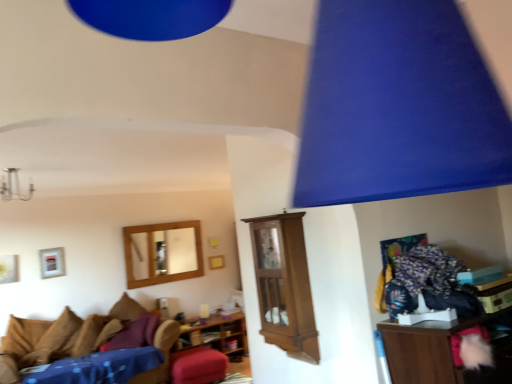
The image size is (512, 384). What do you see at coordinates (106, 332) in the screenshot?
I see `brown suede pillow at lower left, which is the first pillow from front to back` at bounding box center [106, 332].

You are a GUI agent. You are given a task and a screenshot of the screen. Output one action in this format:
    pyautogui.click(x=<x>, y=<y>)
    Task: Click on the wooden cabinet at center, the second shelf from the back
    The height and width of the screenshot is (384, 512).
    Given the screenshot: What is the action you would take?
    pyautogui.click(x=284, y=285)

At what (x,y) coordinates should I click in order to perform the action: click on wooden shelf at center, the 1th shelf positioned from the left. Please return your answer as a coordinate pair (x, y). The height and width of the screenshot is (384, 512). Looking at the image, I should click on (218, 335).

Find the location of a particular element. This screenshot has height=384, width=512. metallic chandelier at upper left is located at coordinates (14, 187).

The height and width of the screenshot is (384, 512). What do you see at coordinates (60, 336) in the screenshot?
I see `velvet purple sofa at lower left` at bounding box center [60, 336].

You are a GUI agent. You are given a task and a screenshot of the screen. Output one action in this format:
    pyautogui.click(x=<x>, y=<y>)
    Task: Click on the velvet purple sofa at lower left
    This screenshot has width=512, height=384.
    Given the screenshot: What is the action you would take?
    pyautogui.click(x=60, y=336)

Locate an element on the screen. This screenshot has width=512, height=384. silver metallic picture frame at upper left, which is counted as the 2th picture frame, starting from the back is located at coordinates (52, 262).

Could velvet red stool at center be considered to be inside velvet purple sofa at lower left?

No, velvet red stool at center is not a part of velvet purple sofa at lower left.

Is velvet purple sofa at lower left positioned far away from velvet red stool at center?

velvet purple sofa at lower left is positioned a significant distance from velvet red stool at center.

Does point (90, 321) come farther from viewer compared to point (199, 370)?

That is True.

Is metallic chandelier at upper left facing towards velvet purple sofa at lower left?

No, metallic chandelier at upper left is not oriented towards velvet purple sofa at lower left.

From a real-world perspective, is metallic chandelier at upper left physically above velvet purple sofa at lower left?

Yes.

Between point (10, 175) and point (41, 331), which one is positioned behind?

The point (41, 331) is more distant.

Who is bigger, metallic chandelier at upper left or velvet purple sofa at lower left?

velvet purple sofa at lower left is bigger.

Which is in front, point (186, 344) or point (14, 192)?

The point (14, 192) is closer to the camera.

Based on the photo, what's the angular difference between wooden shelf at center, the 1th shelf positioned from the left, and metallic chandelier at upper left's facing directions?

89.1 degrees.

Does wooden shelf at center, arranged as the 2th shelf when viewed from the right, come behind metallic chandelier at upper left?

Yes, it is behind metallic chandelier at upper left.

How distant is wooden shelf at center, which appears as the first shelf when ordered from the bottom, from metallic chandelier at upper left?

A distance of 2.72 meters exists between wooden shelf at center, which appears as the first shelf when ordered from the bottom, and metallic chandelier at upper left.

From the image's perspective, between wooden cabinet at center, marked as the first shelf in a front-to-back arrangement, and silver metallic picture frame at upper left, which is counted as the 2th picture frame, starting from the back, which one is located above?

wooden cabinet at center, marked as the first shelf in a front-to-back arrangement, from the image's perspective.

Consider the image. Are wooden cabinet at center, acting as the 2th shelf starting from the left, and silver metallic picture frame at upper left, arranged as the 2th picture frame when viewed from the right, located far from each other?

Yes, wooden cabinet at center, acting as the 2th shelf starting from the left, is far from silver metallic picture frame at upper left, arranged as the 2th picture frame when viewed from the right.

From a real-world perspective, relative to silver metallic picture frame at upper left, which is counted as the 1th picture frame, starting from the left, is wooden cabinet at center, acting as the 2th shelf starting from the left, vertically above or below?

In terms of real-world spatial position, wooden cabinet at center, acting as the 2th shelf starting from the left, is below silver metallic picture frame at upper left, which is counted as the 1th picture frame, starting from the left.

Does point (194, 275) come in front of point (80, 333)?

That is False.

From a real-world perspective, is wooden/matte picture frame at center, placed as the second picture frame when sorted from front to back, located beneath velvet purple sofa at lower left?

No, from a real-world perspective, wooden/matte picture frame at center, placed as the second picture frame when sorted from front to back, is not below velvet purple sofa at lower left.

In the scene shown: Can you tell me how much wooden/matte picture frame at center, placed as the second picture frame when sorted from front to back, and velvet purple sofa at lower left differ in facing direction?

There is a 0.404-degree angle between the facing directions of wooden/matte picture frame at center, placed as the second picture frame when sorted from front to back, and velvet purple sofa at lower left.

Is wooden/matte picture frame at center, which is the first picture frame from right to left, looking in the opposite direction of velvet purple sofa at lower left?

No, wooden/matte picture frame at center, which is the first picture frame from right to left, is not facing the opposite direction of velvet purple sofa at lower left.

From a real-world perspective, which is physically below, brown fabric pillow at lower left, which is counted as the 2th pillow, starting from the front, or metallic chandelier at upper left?

brown fabric pillow at lower left, which is counted as the 2th pillow, starting from the front, from a real-world perspective.

What's the angular difference between brown fabric pillow at lower left, the first pillow positioned from the back, and metallic chandelier at upper left's facing directions?

brown fabric pillow at lower left, the first pillow positioned from the back, and metallic chandelier at upper left are facing 122 degrees away from each other.

Which object is wider, brown fabric pillow at lower left, which is counted as the 2th pillow, starting from the front, or metallic chandelier at upper left?

With larger width is brown fabric pillow at lower left, which is counted as the 2th pillow, starting from the front.

Considering the relative positions of brown suede pillow at lower left, which is the 2th pillow in back-to-front order, and wooden cabinet at center, marked as the first shelf in a front-to-back arrangement, in the image provided, is brown suede pillow at lower left, which is the 2th pillow in back-to-front order, behind wooden cabinet at center, marked as the first shelf in a front-to-back arrangement,?

Yes, it is behind wooden cabinet at center, marked as the first shelf in a front-to-back arrangement.

From a real-world perspective, between brown suede pillow at lower left, which is the 2th pillow in back-to-front order, and wooden cabinet at center, the second shelf from the back, who is vertically higher?

In real-world perspective, wooden cabinet at center, the second shelf from the back, is above.

What are the coordinates of `the 1st pillow behind when counting from the wooden cabinet at center, which is the first shelf in right-to-left order` in the screenshot? It's located at (106, 332).

Is wooden cabinet at center, the second shelf from the back, at the back of brown suede pillow at lower left, which is the 2th pillow in back-to-front order?

That's not correct — brown suede pillow at lower left, which is the 2th pillow in back-to-front order, is not looking away from wooden cabinet at center, the second shelf from the back.

Image resolution: width=512 pixels, height=384 pixels. I want to click on stool on the right of velvet purple sofa at lower left, so click(197, 366).

You are a GUI agent. You are given a task and a screenshot of the screen. Output one action in this format:
    pyautogui.click(x=<x>, y=<y>)
    Task: Click on the lamp on the left side of velvet purple sofa at lower left
    
    Given the screenshot: What is the action you would take?
    pyautogui.click(x=14, y=187)

Looking at this image, based on their spatial positions, is silver metallic picture frame at upper left, which is counted as the 2th picture frame, starting from the back, or metallic chandelier at upper left further from velvet purple sofa at lower left?

metallic chandelier at upper left is further to velvet purple sofa at lower left.

Consider the image. When comparing their distances from velvet red stool at center, does wooden shelf at center, which appears as the first shelf when ordered from the bottom, or metallic chandelier at upper left seem further?

Among the two, metallic chandelier at upper left is located further to velvet red stool at center.

From the image, which object appears to be farther from wooden cabinet at center, which is the first shelf in right-to-left order, velvet red stool at center or silver metallic picture frame at upper left, the 1th picture frame viewed from the front?

Among the two, silver metallic picture frame at upper left, the 1th picture frame viewed from the front, is located further to wooden cabinet at center, which is the first shelf in right-to-left order.

Looking at the image, which one is located closer to wooden/matte picture frame at center, which is the first picture frame in back-to-front order, metallic chandelier at upper left or wooden cabinet at center, marked as the first shelf in a front-to-back arrangement?

metallic chandelier at upper left lies closer to wooden/matte picture frame at center, which is the first picture frame in back-to-front order, than the other object.

When comparing their distances from wooden/matte picture frame at center, placed as the second picture frame when sorted from left to right, does wooden cabinet at center, which is the first shelf in right-to-left order, or silver metallic picture frame at upper left, the 1th picture frame viewed from the front, seem further?

Based on the image, wooden cabinet at center, which is the first shelf in right-to-left order, appears to be further to wooden/matte picture frame at center, placed as the second picture frame when sorted from left to right.

Based on their spatial positions, is brown fabric pillow at lower left, the first pillow positioned from the back, or metallic chandelier at upper left further from brown suede pillow at lower left, which is the first pillow from front to back?

Among the two, metallic chandelier at upper left is located further to brown suede pillow at lower left, which is the first pillow from front to back.

Looking at the image, which one is located further to brown fabric pillow at lower left, which is counted as the 2th pillow, starting from the front, brown suede pillow at lower left, which is the first pillow from front to back, or wooden/matte picture frame at center, placed as the second picture frame when sorted from left to right?

Based on the image, wooden/matte picture frame at center, placed as the second picture frame when sorted from left to right, appears to be further to brown fabric pillow at lower left, which is counted as the 2th pillow, starting from the front.

Looking at the image, which one is located further to wooden/matte picture frame at center, which is the first picture frame from right to left, wooden shelf at center, which is the 2th shelf from front to back, or brown fabric pillow at lower left, which is counted as the 2th pillow, starting from the front?

wooden shelf at center, which is the 2th shelf from front to back, is positioned further to the anchor wooden/matte picture frame at center, which is the first picture frame from right to left.

Image resolution: width=512 pixels, height=384 pixels. What are the coordinates of `furniture that lies between metallic chandelier at upper left and velvet red stool at center from top to bottom` in the screenshot? It's located at (60, 336).

Image resolution: width=512 pixels, height=384 pixels. I want to click on picture frame between metallic chandelier at upper left and wooden/matte picture frame at center, which is the first picture frame in back-to-front order, from front to back, so click(x=52, y=262).

Find the location of a particular element. The width and height of the screenshot is (512, 384). furniture located between silver metallic picture frame at upper left, the 1th picture frame viewed from the front, and wooden shelf at center, which appears as the first shelf when ordered from the bottom, in the left-right direction is located at coordinates (60, 336).

Locate an element on the screen. picture frame between velvet purple sofa at lower left and wooden/matte picture frame at center, placed as the second picture frame when sorted from front to back, along the z-axis is located at coordinates (52, 262).